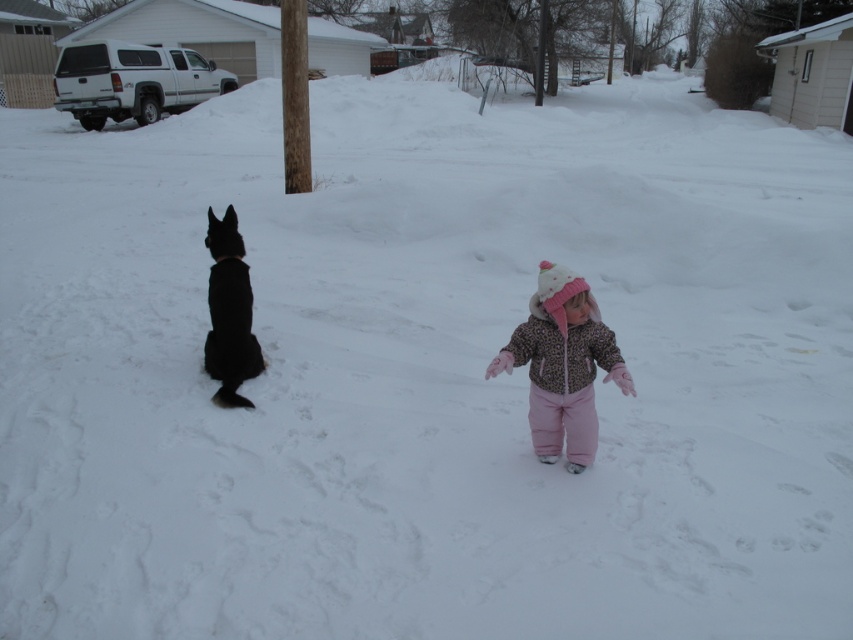
Which is below, leopard print jacket at center or black fur dog at left?

leopard print jacket at center is lower down.

Is point (561, 355) positioned in front of point (251, 365)?

Yes, point (561, 355) is in front of point (251, 365).

This screenshot has width=853, height=640. I want to click on leopard print jacket at center, so click(561, 365).